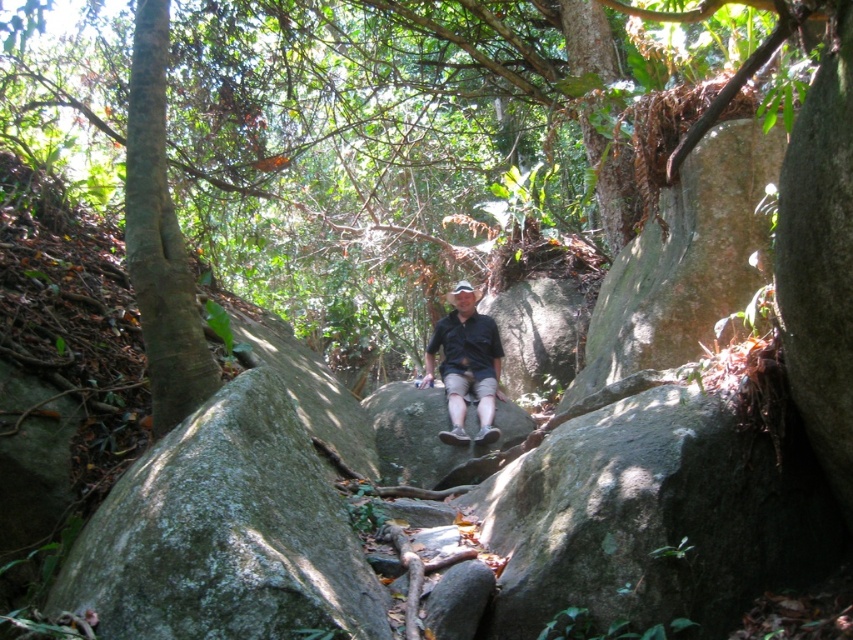
You are a hiker who wants to sit on the gray rough rock at center. You are wearing a matte black shirt at center. Can you safely sit on the rock without your shirt getting dirty?

The gray rough rock at center is shorter than the matte black shirt at center, so the shirt might touch the ground or the rock when sitting, leading to potential dirt on the shirt.

You are planning to take a photo of the green leafy tree at center and the gray rough rock at center in the forest scene. Which object should you focus on first if you want to capture both in a single frame without moving the camera?

The green leafy tree at center is bigger than the gray rough rock at center, so you should focus on the green leafy tree at center first to ensure it fills the frame appropriately while still capturing the smaller gray rough rock at center in the background.

You are a hiker who wants to take a photo of the green leafy tree at center and the matte black shirt at center. Which object is located above the other?

The green leafy tree at center is positioned over matte black shirt at center, so the tree is above the shirt.